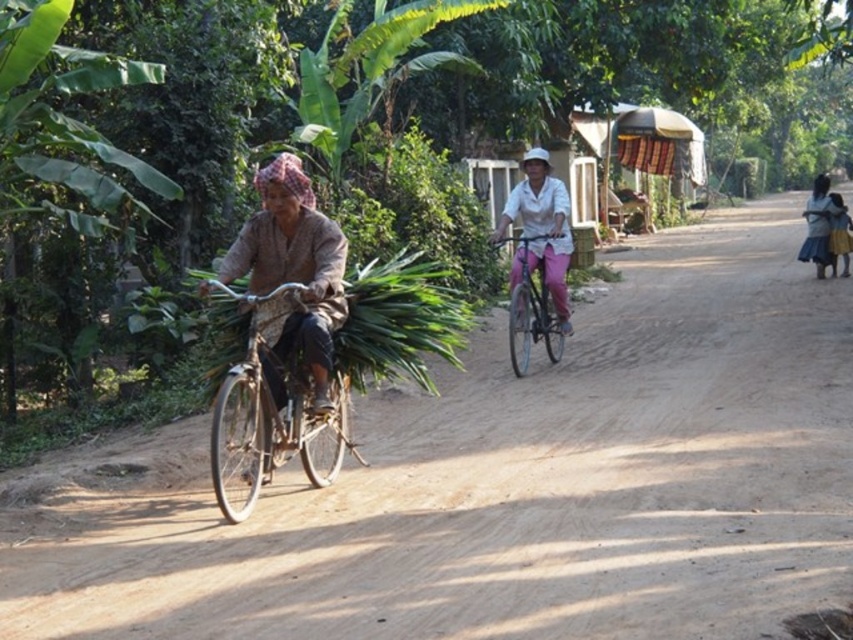
In the scene shown: You are a traveler trying to decide whether to walk on the brown dirt track at center or wear the blue denim skirt at right. Which option takes up more space?

The blue denim skirt at right is larger than the brown dirt track at center, so it takes up more space.

You are standing at the point marked as point [270,412] in the image. What object is located exactly at this point?

The metallic silver bicycle at left is located exactly at point [270,412].